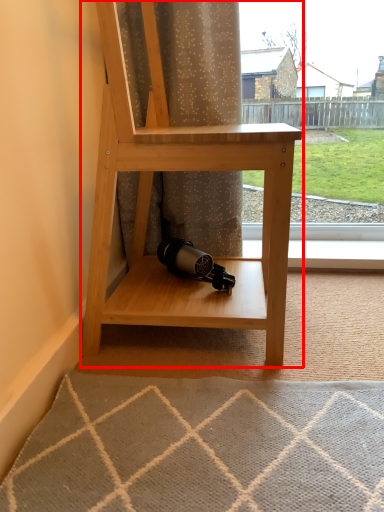
Question: Where is shelf (annotated by the red box) located in relation to curtain in the image?

Choices:
 (A) left
 (B) right

Answer: (B)